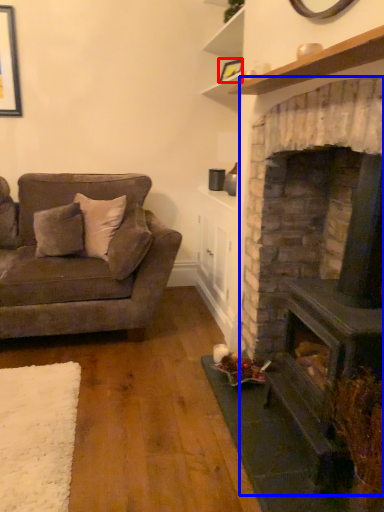
Question: Which object appears closest to the camera in this image, picture frame (highlighted by a red box) or fireplace (highlighted by a blue box)?

Choices:
 (A) picture frame
 (B) fireplace

Answer: (B)